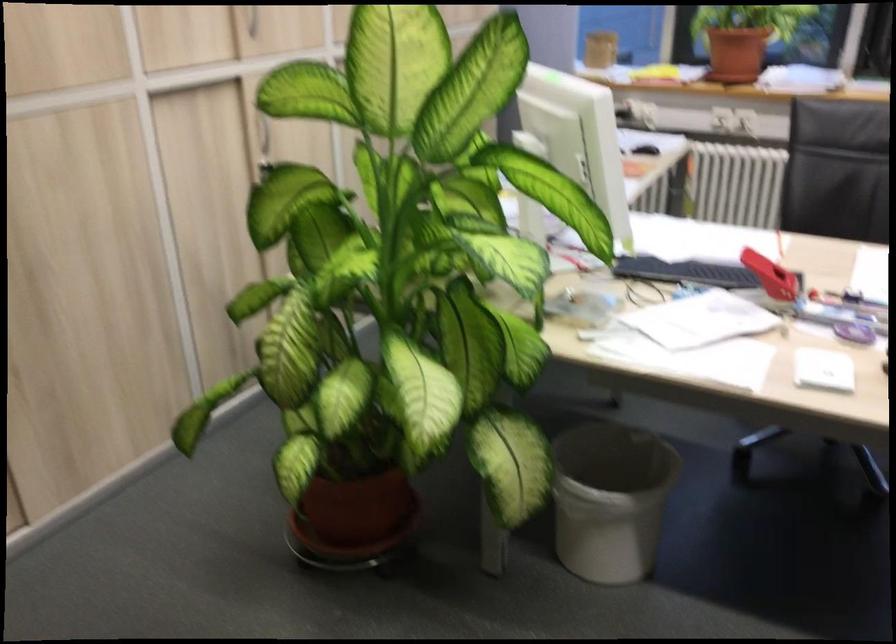
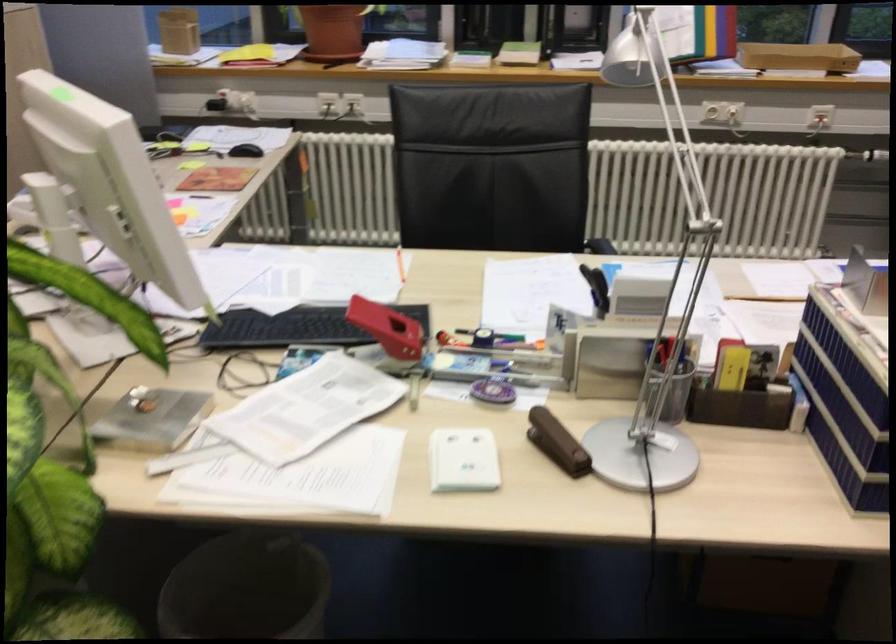
Find the pixel in the second image that matches (767,272) in the first image.

(388, 328)